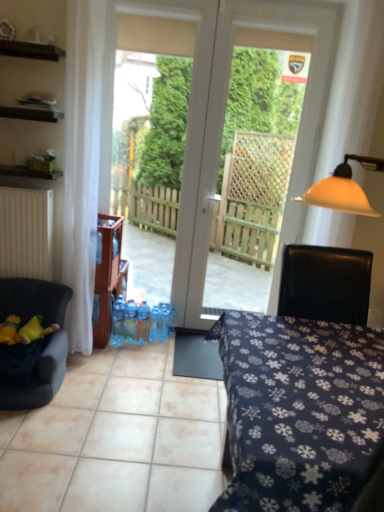
This screenshot has height=512, width=384. Find the location of `free space to the right of clear plastic bottles at center, the first bottle positioned from the left`. free space to the right of clear plastic bottles at center, the first bottle positioned from the left is located at coordinates (143, 348).